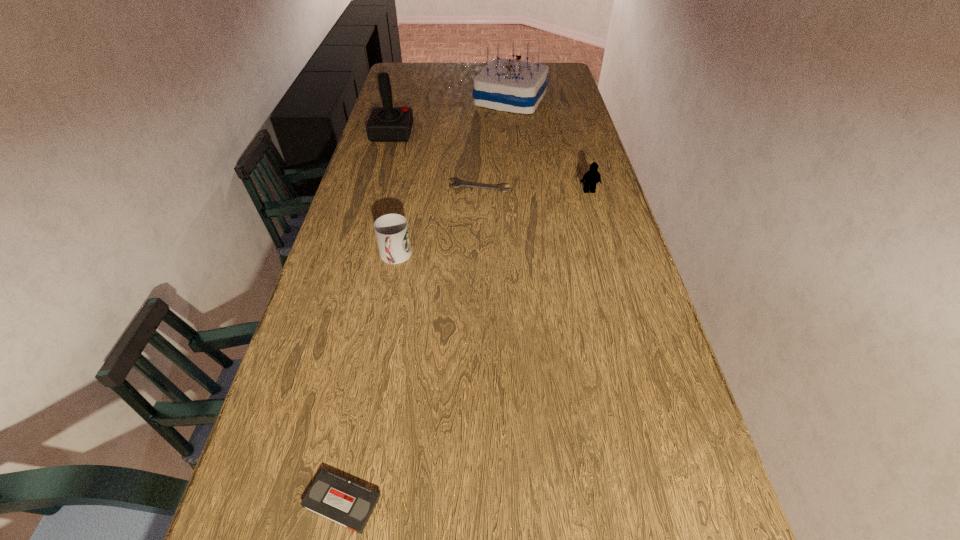
Locate an element on the screen. This screenshot has height=540, width=960. free space between the Lego and the farthest object is located at coordinates (550, 145).

At what (x,y) coordinates should I click in order to perform the action: click on the third closest object to the second farthest object. Please return your answer as a coordinate pair (x, y). Looking at the image, I should click on (392, 233).

What are the coordinates of `object that is the fifth closest to the second shortest object` in the screenshot? It's located at coord(508,85).

At what (x,y) coordinates should I click in order to perform the action: click on vacant area in the image that satisfies the following two spatial constraints: 1. on the base of the joystick; 2. on the left side of the shortest object. Please return your answer as a coordinate pair (x, y). The width and height of the screenshot is (960, 540). Looking at the image, I should click on (377, 186).